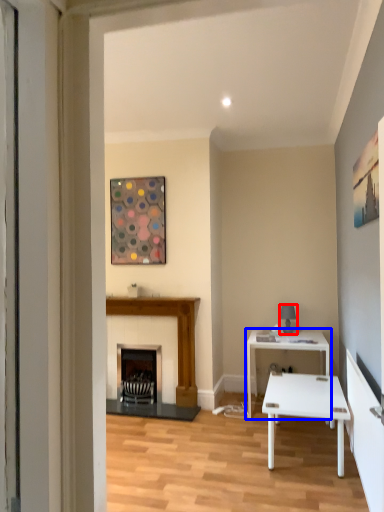
Question: Among these objects, which one is nearest to the camera, lamp (highlighted by a red box) or table (highlighted by a blue box)?

Choices:
 (A) lamp
 (B) table

Answer: (B)